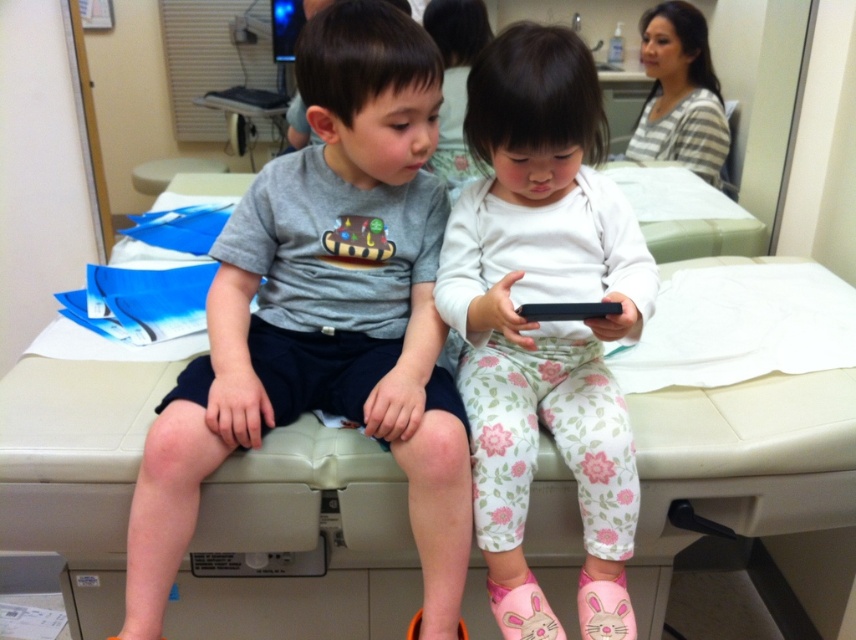
Question: Which object is farther from the camera taking this photo?

Choices:
 (A) gray matte shirt at center
 (B) black matte smartphone at center
 (C) white floral leggings at center

Answer: (A)

Question: Does white floral leggings at center have a larger size compared to black matte smartphone at center?

Choices:
 (A) no
 (B) yes

Answer: (B)

Question: Among these objects, which one is farthest from the camera?

Choices:
 (A) gray matte shirt at center
 (B) white floral leggings at center
 (C) black matte smartphone at center

Answer: (A)

Question: Can you confirm if gray matte shirt at center is positioned to the right of white floral leggings at center?

Choices:
 (A) no
 (B) yes

Answer: (A)

Question: Which is farther from the gray matte shirt at center?

Choices:
 (A) white floral leggings at center
 (B) black matte smartphone at center

Answer: (B)

Question: Where is gray matte shirt at center located in relation to white floral leggings at center in the image?

Choices:
 (A) left
 (B) right

Answer: (A)